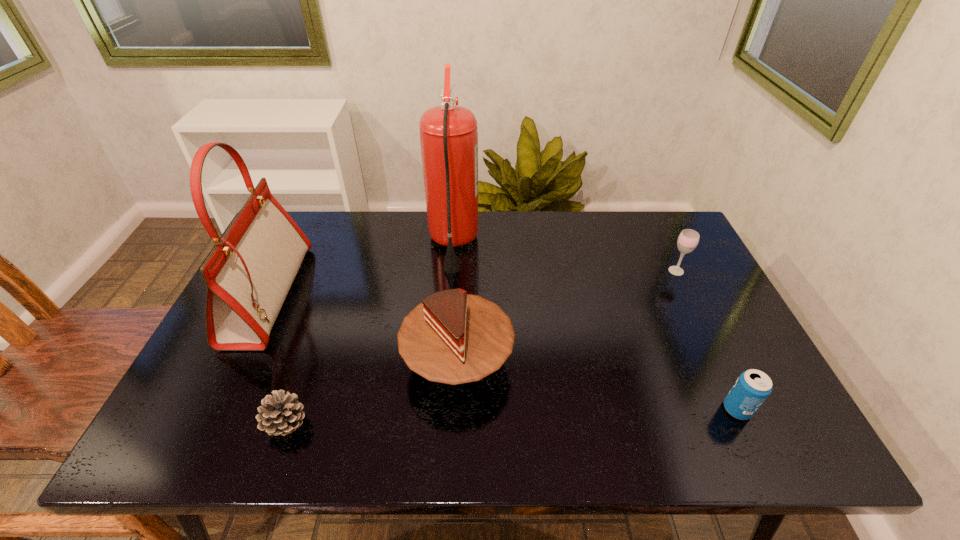
The image size is (960, 540). Find the location of `blank region between the fifth object from right to left and the leftmost object`. blank region between the fifth object from right to left and the leftmost object is located at coordinates pos(277,360).

Locate an element on the screen. This screenshot has height=540, width=960. free space between the third tallest object and the handbag is located at coordinates (364, 328).

Where is `free space between the soda can and the wineglass`? The width and height of the screenshot is (960, 540). free space between the soda can and the wineglass is located at coordinates (707, 340).

At what (x,y) coordinates should I click in order to perform the action: click on vacant space in between the pinecone and the leftmost object. Please return your answer as a coordinate pair (x, y). Looking at the image, I should click on (277, 360).

I want to click on vacant space in between the fire extinguisher and the leftmost object, so click(x=361, y=269).

What are the coordinates of `object that ranks as the third closest to the handbag` in the screenshot? It's located at (448, 133).

Identify which object is the third closest to the soda can. Please provide its 2D coordinates. Your answer should be formatted as a tuple, i.e. [(x, y)], where the tuple contains the x and y coordinates of a point satisfying the conditions above.

[(448, 133)]

Image resolution: width=960 pixels, height=540 pixels. In order to click on blank space that satisfies the following two spatial constraints: 1. on the instruction side of the cake; 2. on the right side of the fire extinguisher in this screenshot , I will do coord(445,361).

This screenshot has height=540, width=960. Find the location of `vacant space that satisfies the following two spatial constraints: 1. on the back side of the cake; 2. on the right side of the wineglass`. vacant space that satisfies the following two spatial constraints: 1. on the back side of the cake; 2. on the right side of the wineglass is located at coordinates (462, 271).

You are a GUI agent. You are given a task and a screenshot of the screen. Output one action in this format:
    pyautogui.click(x=<x>, y=<y>)
    Task: Click on the blank area in the image that satisfies the following two spatial constraints: 1. on the back side of the shortest object; 2. on the right side of the soda can
    Image resolution: width=960 pixels, height=540 pixels.
    Given the screenshot: What is the action you would take?
    pyautogui.click(x=291, y=409)